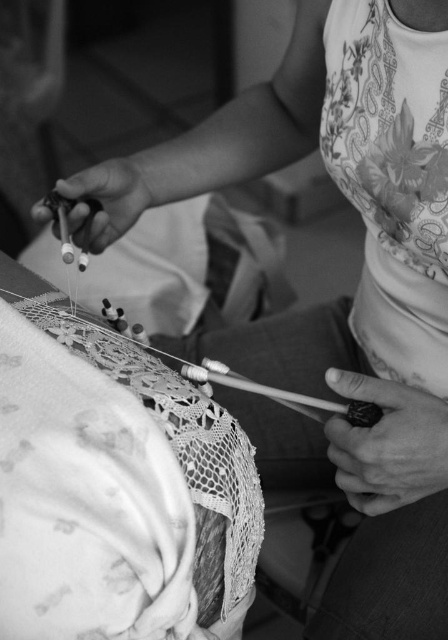
In the image of the lace maker, there is a point at coordinates [387,444]. What object is located at that point?

The point at coordinates [387,444] corresponds to a smooth black tattoo at lower right.